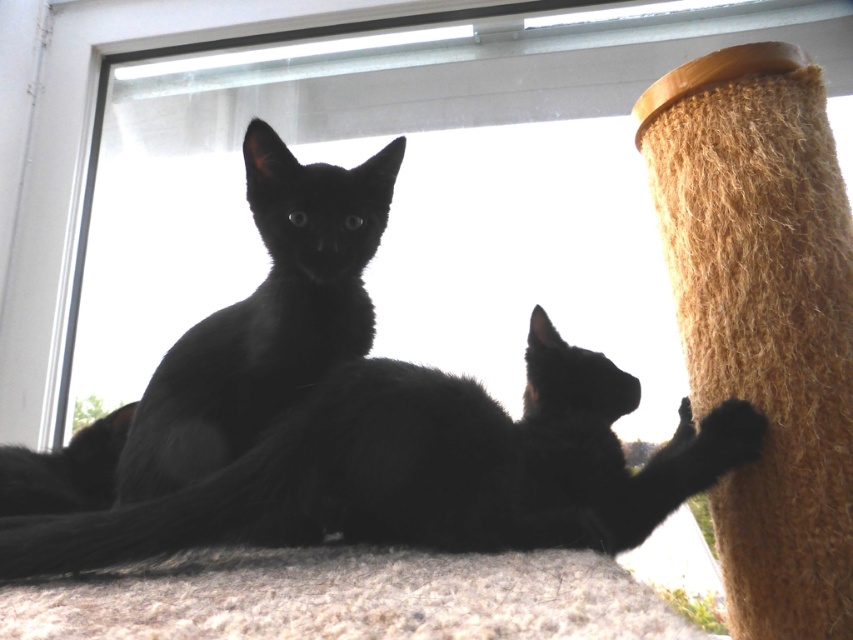
This screenshot has height=640, width=853. What do you see at coordinates (422, 468) in the screenshot?
I see `black fur cat at center` at bounding box center [422, 468].

Based on the photo, does black fur cat at center have a lesser width compared to black fur cat at upper left?

No, black fur cat at center is not thinner than black fur cat at upper left.

Does point (264, 531) come closer to viewer compared to point (364, 232)?

Yes, it is.

The height and width of the screenshot is (640, 853). Identify the location of black fur cat at center. (422, 468).

Looking at this image, is the position of transparent glass door at upper center more distant than that of black fur cat at upper left?

Yes, it is behind black fur cat at upper left.

In the scene shown: Is transparent glass door at upper center thinner than black fur cat at upper left?

In fact, transparent glass door at upper center might be wider than black fur cat at upper left.

Between point (479, 323) and point (160, 483), which one is positioned in front?

Point (160, 483) is in front.

Locate an element on the screen. transparent glass door at upper center is located at coordinates 352,148.

Does transparent glass door at upper center appear over black fur cat at center?

Yes, transparent glass door at upper center is above black fur cat at center.

Can you confirm if transparent glass door at upper center is bigger than black fur cat at center?

Yes.

Measure the distance between point (473,74) and camera.

They are 1.92 meters apart.

Locate an element on the screen. This screenshot has width=853, height=640. transparent glass door at upper center is located at coordinates click(x=352, y=148).